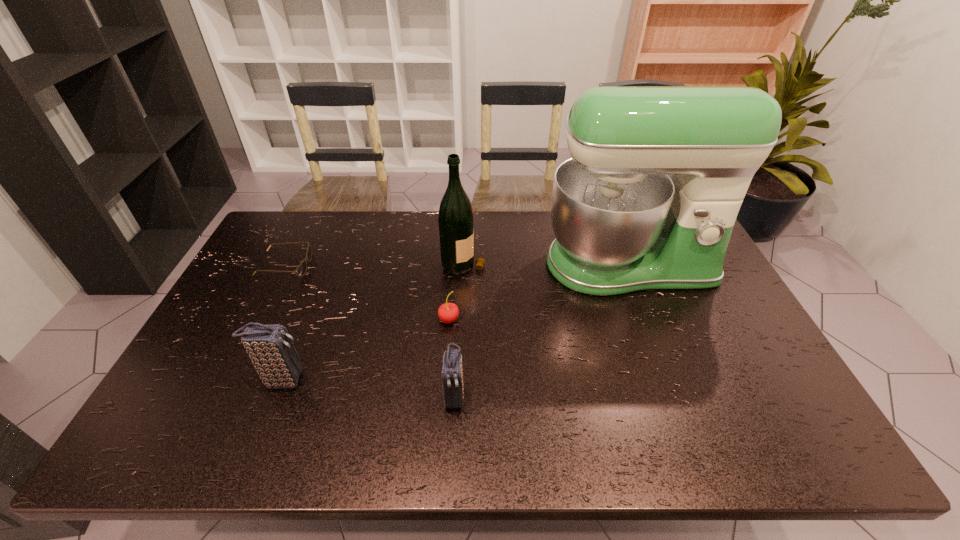
At what (x,y) coordinates should I click in order to perform the action: click on free point between the cherry and the left clutch bag. Please return your answer as a coordinate pair (x, y). This screenshot has height=540, width=960. Looking at the image, I should click on (366, 350).

Where is `free area in between the left clutch bag and the fourth tallest object`? free area in between the left clutch bag and the fourth tallest object is located at coordinates (369, 388).

The image size is (960, 540). I want to click on free space between the tallest object and the wine bottle, so click(546, 264).

Where is `unoccupied position between the shortest object and the left clutch bag`? Image resolution: width=960 pixels, height=540 pixels. unoccupied position between the shortest object and the left clutch bag is located at coordinates (284, 323).

Locate an element on the screen. The image size is (960, 540). empty location between the third nearest object and the shortest object is located at coordinates (367, 293).

You are a GUI agent. You are given a task and a screenshot of the screen. Output one action in this format:
    pyautogui.click(x=<x>, y=<y>)
    Task: Click on the object that is the nearest to the shortest object
    
    Given the screenshot: What is the action you would take?
    (x=270, y=347)

Locate an element on the screen. This screenshot has width=960, height=540. object that is the fourth closest to the right clutch bag is located at coordinates (456, 230).